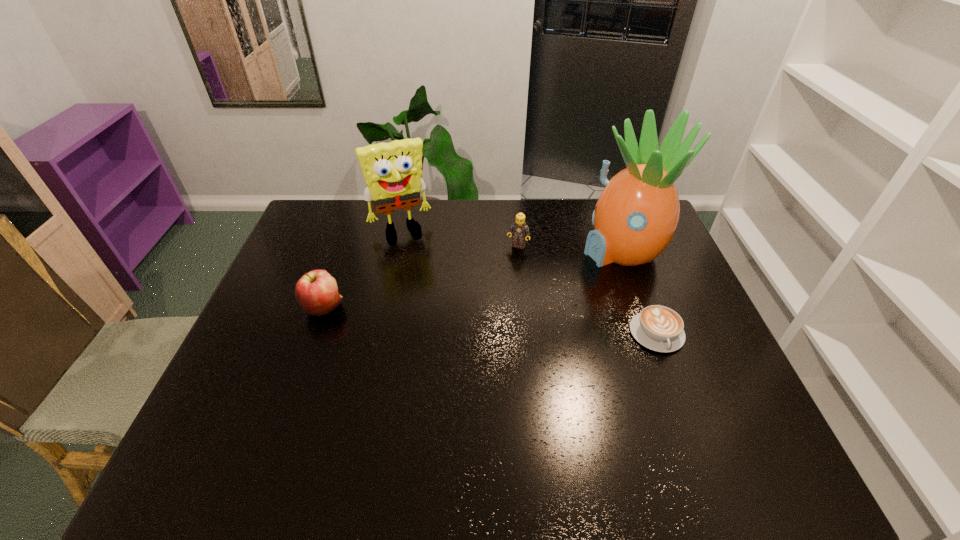
This screenshot has height=540, width=960. I want to click on free space on the desktop that is between the leftmost object and the shortest object and is positioned in front of the third object from right to left, so click(487, 320).

Where is `free space on the desktop that is between the apple and the cappuccino and is positioned on the face of the second tallest object`? Image resolution: width=960 pixels, height=540 pixels. free space on the desktop that is between the apple and the cappuccino and is positioned on the face of the second tallest object is located at coordinates (438, 316).

Image resolution: width=960 pixels, height=540 pixels. Identify the location of free space on the desktop that is between the apple and the shortest object and is positioned at the entrance of the pineapple. (438, 316).